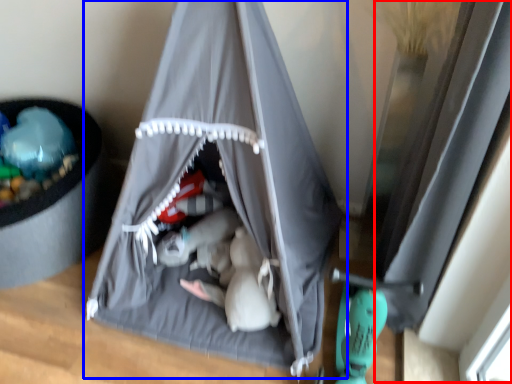
Question: Which point is closer to the camera, window (highlighted by a red box) or tent (highlighted by a blue box)?

Choices:
 (A) window
 (B) tent

Answer: (B)